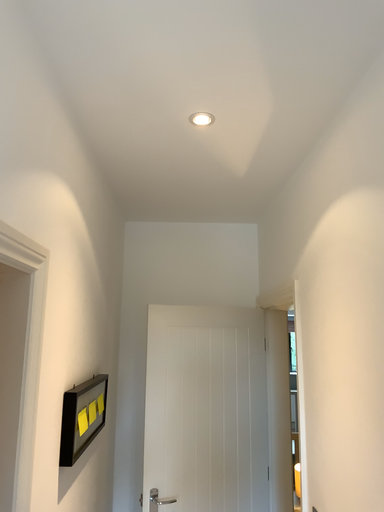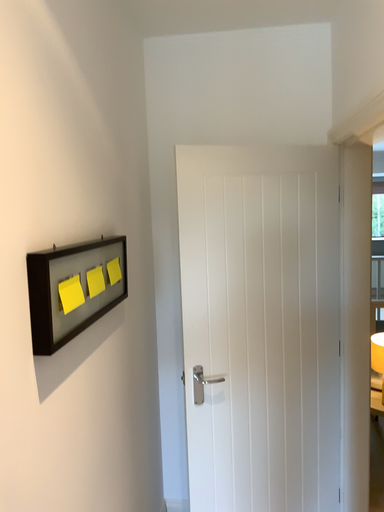
Question: Which way did the camera rotate in the video?

Choices:
 (A) rotated downward
 (B) rotated upward

Answer: (A)